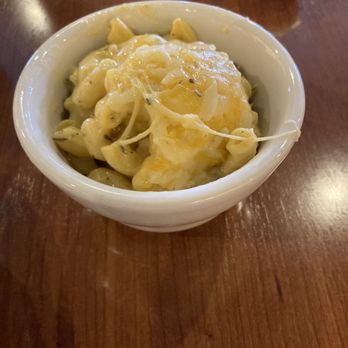
Where is `light glares on bowl`? Image resolution: width=348 pixels, height=348 pixels. light glares on bowl is located at coordinates (290, 78), (45, 51).